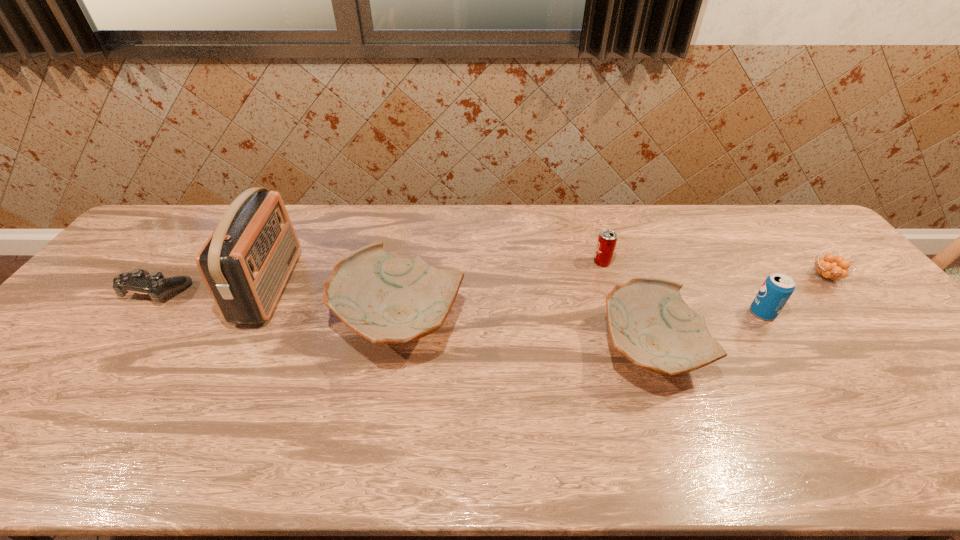
Please point a free position for a pottery on the right. Please provide its 2D coordinates. Your answer should be formatted as a tuple, i.e. [(x, y)], where the tuple contains the x and y coordinates of a point satisfying the conditions above.

[(932, 382)]